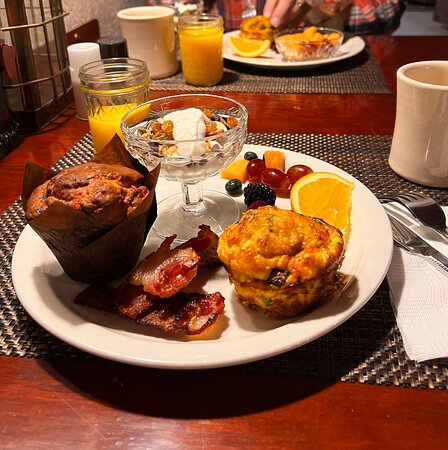
The width and height of the screenshot is (448, 450). I want to click on white plate, so click(x=224, y=360).